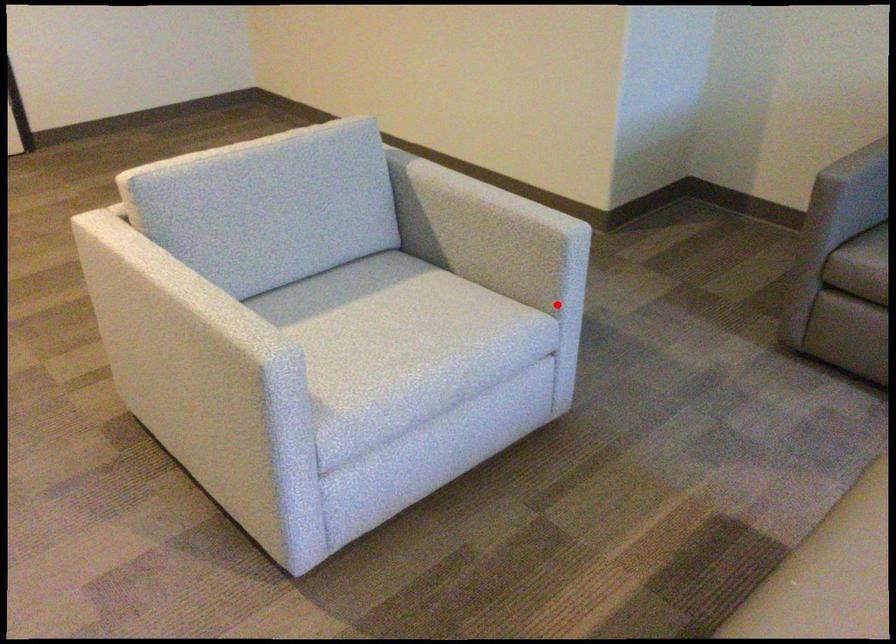
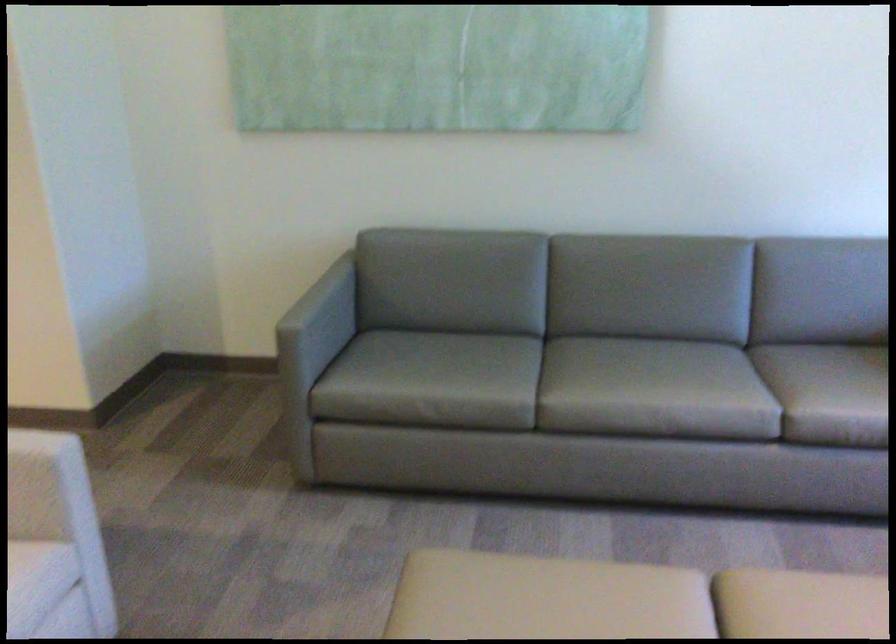
The point at the highlighted location is marked in the first image. Where is the corresponding point in the second image?

(55, 542)